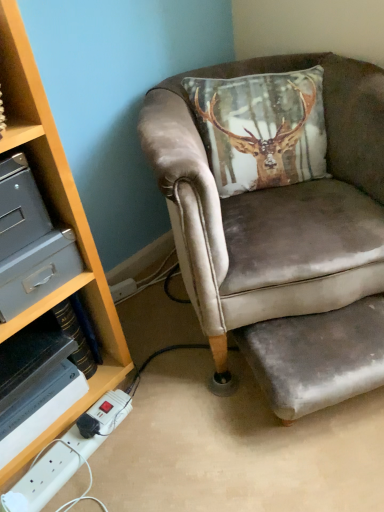
Question: Is white plastic power strip at lower left facing towards velvet grey footrest at lower right?

Choices:
 (A) no
 (B) yes

Answer: (A)

Question: From a real-world perspective, is white plastic power strip at lower left physically below velvet grey footrest at lower right?

Choices:
 (A) yes
 (B) no

Answer: (A)

Question: Is white plastic power strip at lower left at the left side of velvet grey footrest at lower right?

Choices:
 (A) yes
 (B) no

Answer: (A)

Question: Does white plastic power strip at lower left have a greater height compared to velvet grey footrest at lower right?

Choices:
 (A) no
 (B) yes

Answer: (A)

Question: Is white plastic power strip at lower left positioned beyond the bounds of velvet grey footrest at lower right?

Choices:
 (A) yes
 (B) no

Answer: (A)

Question: Considering the positions of velvet grey footrest at lower right and metallic gray drawer at left in the image, is velvet grey footrest at lower right taller or shorter than metallic gray drawer at left?

Choices:
 (A) tall
 (B) short

Answer: (A)

Question: Relative to metallic gray drawer at left, is velvet grey footrest at lower right in front or behind?

Choices:
 (A) front
 (B) behind

Answer: (B)

Question: Considering the positions of point (256, 344) and point (3, 313), is point (256, 344) closer or farther from the camera than point (3, 313)?

Choices:
 (A) closer
 (B) farther

Answer: (B)

Question: Visually, is velvet grey footrest at lower right positioned to the left or to the right of metallic gray drawer at left?

Choices:
 (A) left
 (B) right

Answer: (B)

Question: Would you say velvet brown armchair at center is inside or outside white plastic power strip at lower left?

Choices:
 (A) inside
 (B) outside

Answer: (B)

Question: Considering the positions of velvet brown armchair at center and white plastic power strip at lower left in the image, is velvet brown armchair at center taller or shorter than white plastic power strip at lower left?

Choices:
 (A) short
 (B) tall

Answer: (B)

Question: In terms of width, does velvet brown armchair at center look wider or thinner when compared to white plastic power strip at lower left?

Choices:
 (A) wide
 (B) thin

Answer: (A)

Question: From the image's perspective, is velvet brown armchair at center located above or below white plastic power strip at lower left?

Choices:
 (A) below
 (B) above

Answer: (B)

Question: From the image's perspective, is velvet grey footrest at lower right above or below velvet brown armchair at center?

Choices:
 (A) above
 (B) below

Answer: (B)

Question: Is velvet grey footrest at lower right inside or outside of velvet brown armchair at center?

Choices:
 (A) inside
 (B) outside

Answer: (A)